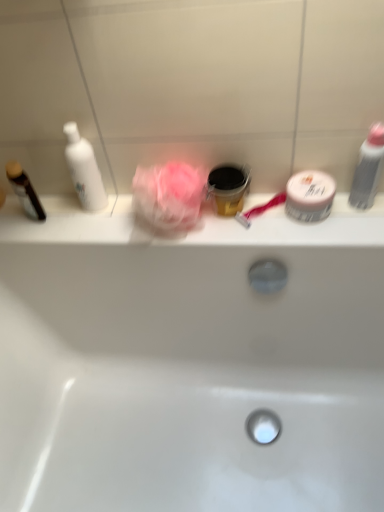
The image size is (384, 512). I want to click on vacant space situated on the left part of gray matte bottle at right, the 4th toiletry positioned from the left, so click(x=301, y=230).